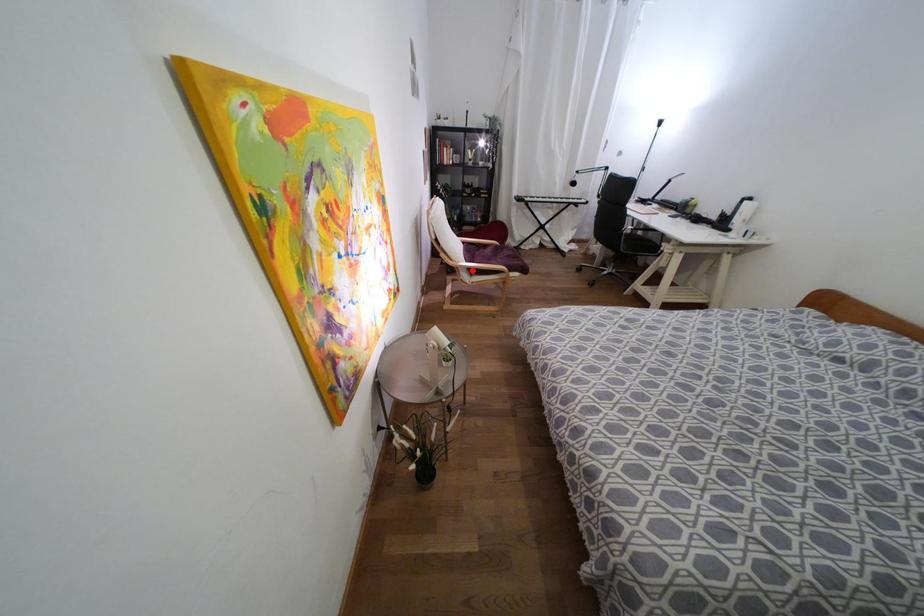
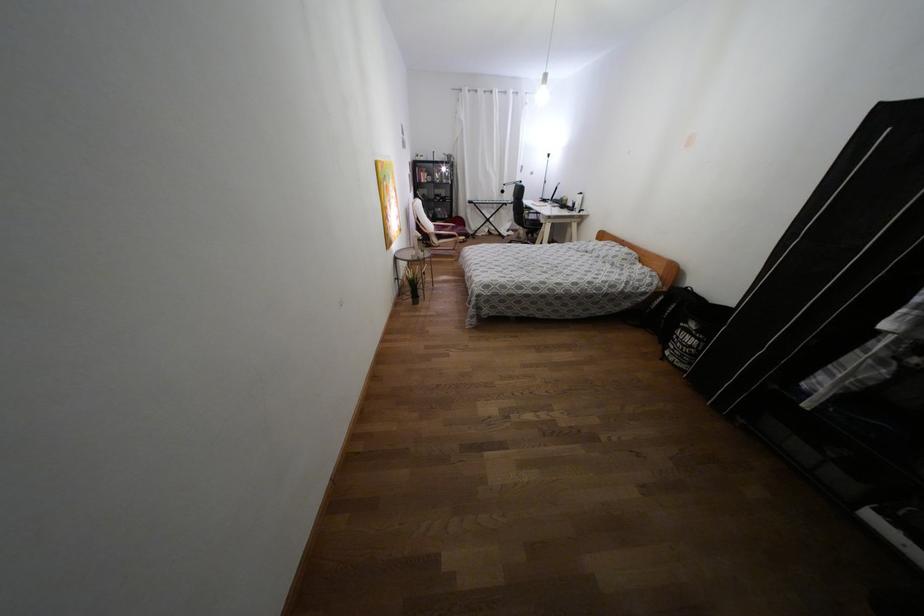
Locate, in the second image, the point that corresponds to the highlighted location in the first image.

(439, 237)